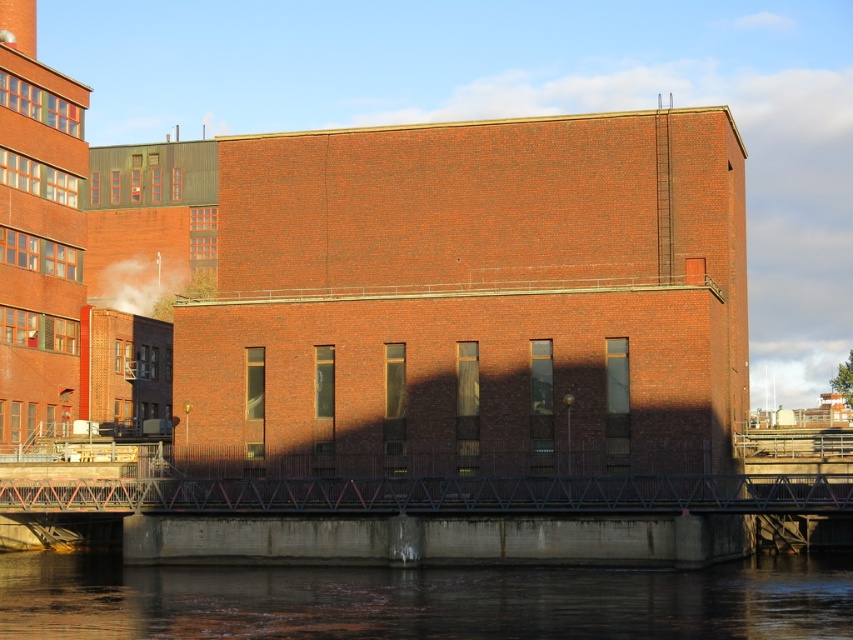
Question: Which point is closer to the camera?

Choices:
 (A) white smoke at upper left
 (B) red brick building at center
 (C) dark concrete water at lower center

Answer: (C)

Question: Which object is positioned closest to the red brick building at center?

Choices:
 (A) dark concrete water at lower center
 (B) white smoke at upper left

Answer: (A)

Question: Observing the image, what is the correct spatial positioning of red brick building at center in reference to white smoke at upper left?

Choices:
 (A) right
 (B) left

Answer: (A)

Question: Which object is positioned closest to the dark concrete water at lower center?

Choices:
 (A) white smoke at upper left
 (B) red brick building at center

Answer: (B)

Question: Is the position of red brick building at center more distant than that of dark concrete water at lower center?

Choices:
 (A) no
 (B) yes

Answer: (B)

Question: Is dark concrete water at lower center smaller than white smoke at upper left?

Choices:
 (A) yes
 (B) no

Answer: (B)